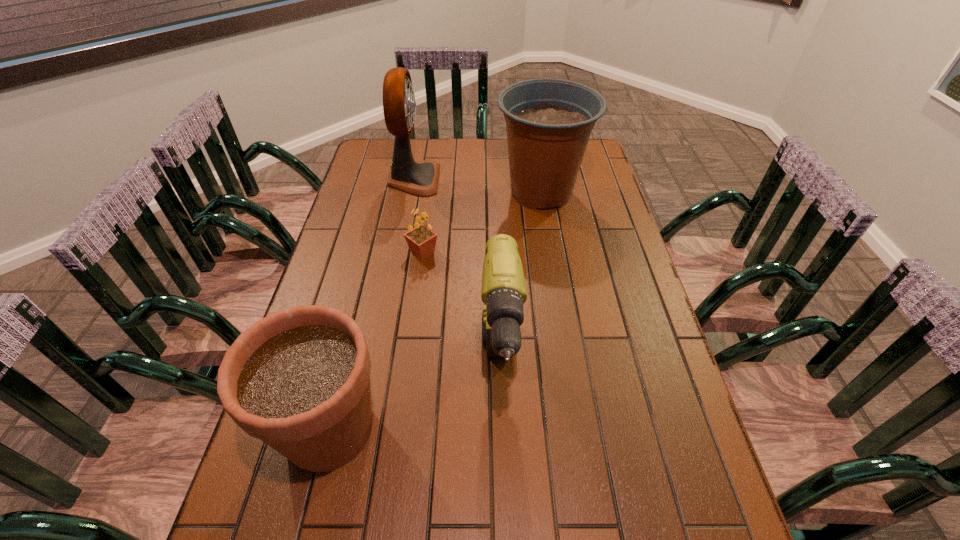
This screenshot has width=960, height=540. Identify the location of the tallest object. (420, 178).

Locate an element on the screen. Image resolution: width=960 pixels, height=540 pixels. the taller flowerpot is located at coordinates (549, 121).

Identify the location of the right flowerpot. This screenshot has height=540, width=960. (549, 121).

Where is `drill`? This screenshot has height=540, width=960. drill is located at coordinates (503, 292).

This screenshot has width=960, height=540. Identify the location of the nearer flowerpot. (299, 379).

Where is `the left flowerpot`? The image size is (960, 540). the left flowerpot is located at coordinates (299, 379).

At what (x,y) coordinates should I click in order to perform the action: click on the third farthest object. Please return your answer as a coordinate pair (x, y). Looking at the image, I should click on (421, 240).

Identify the location of the shortest object. Image resolution: width=960 pixels, height=540 pixels. (421, 240).

I want to click on free space located 0.270m on the front-facing side of the fan, so click(x=512, y=179).

The image size is (960, 540). What are the coordinates of `free space located on the front of the right flowerpot` in the screenshot? It's located at (550, 248).